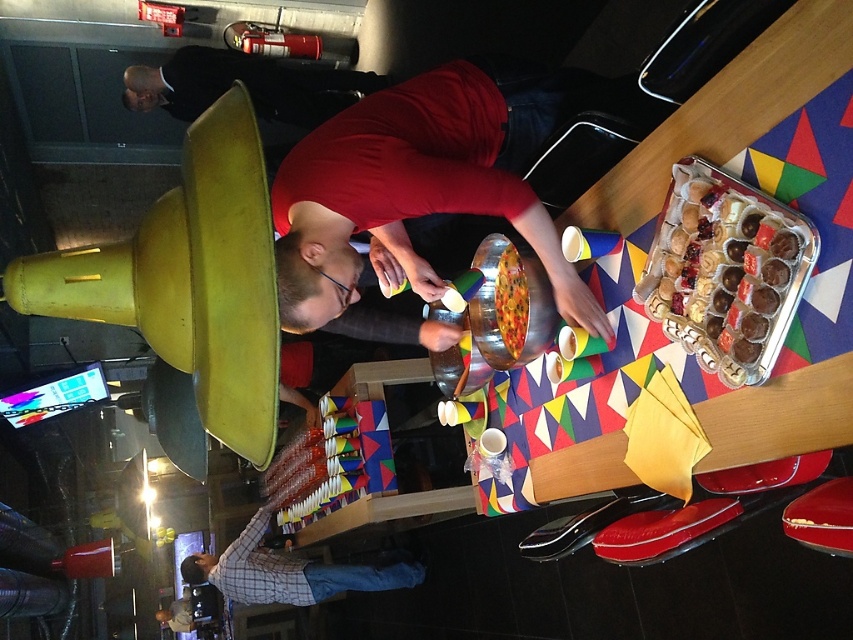
Who is more forward, (480, 124) or (236, 65)?

Point (480, 124) is more forward.

How much distance is there between matte red shirt at center and black suit jacket at upper left?

matte red shirt at center and black suit jacket at upper left are 2.36 meters apart.

In the scene shown: Who is more distant from viewer, (521,209) or (334,99)?

Positioned behind is point (334,99).

Locate an element on the screen. The height and width of the screenshot is (640, 853). matte red shirt at center is located at coordinates (412, 193).

Can you confirm if black suit jacket at upper left is wider than plaid shirt at lower center?

No.

What do you see at coordinates (245, 84) in the screenshot? This screenshot has width=853, height=640. I see `black suit jacket at upper left` at bounding box center [245, 84].

At what (x,y) coordinates should I click in order to perform the action: click on black suit jacket at upper left. Please return your answer as a coordinate pair (x, y). Looking at the image, I should click on (245, 84).

Is matte red shirt at center thinner than metallic silver tray of assorted chocolates at right?

In fact, matte red shirt at center might be wider than metallic silver tray of assorted chocolates at right.

Between point (372, 200) and point (664, 289), which one is positioned behind?

Positioned behind is point (372, 200).

Who is more forward, (410, 211) or (735, 356)?

Point (735, 356) is in front.

At what (x,y) coordinates should I click in order to perform the action: click on matte red shirt at center. Please return your answer as a coordinate pair (x, y). The width and height of the screenshot is (853, 640). Looking at the image, I should click on (412, 193).